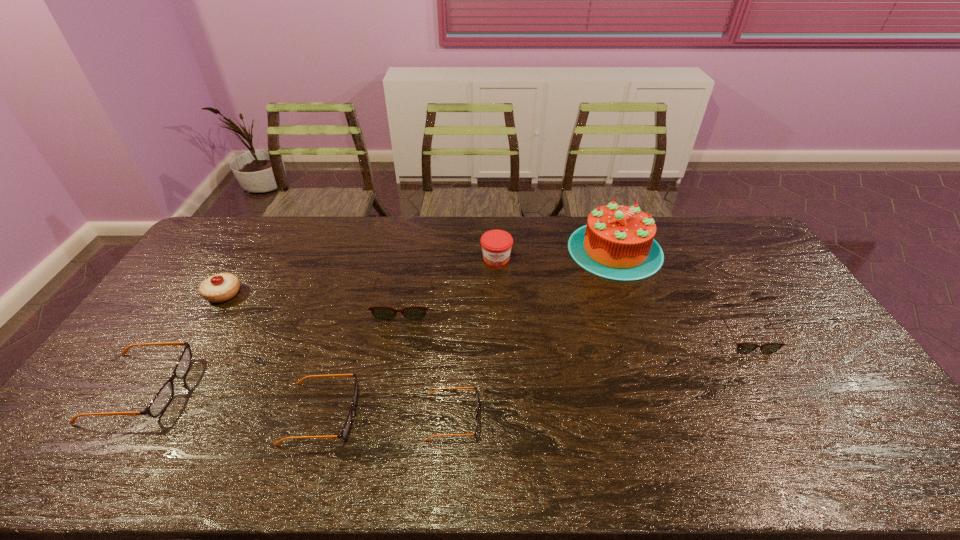
Locate an element on the screen. cake is located at coordinates (617, 243).

The width and height of the screenshot is (960, 540). What are the coordinates of `the tallest object` in the screenshot? It's located at (617, 243).

The image size is (960, 540). In order to click on the third object from right to left in this screenshot , I will do `click(496, 244)`.

This screenshot has width=960, height=540. Find the location of `red jam`. red jam is located at coordinates (496, 244).

This screenshot has width=960, height=540. What are the coordinates of `beige pastry` in the screenshot? It's located at (221, 287).

Identify the location of the bigger brown spectacles. The width and height of the screenshot is (960, 540). (381, 313).

Identify the location of the farther brown spectacles. (x=381, y=313).

You are a GUI agent. You are given a task and a screenshot of the screen. Output one action in this format:
    pyautogui.click(x=<x>, y=<y>)
    Task: Click on the biggest black spectacles
    The image size is (960, 540).
    Given the screenshot: What is the action you would take?
    pyautogui.click(x=161, y=400)

Locate an element on the screen. This screenshot has width=960, height=540. the leftmost black spectacles is located at coordinates (161, 400).

You are a GUI agent. You are given a task and a screenshot of the screen. Output one action in this format:
    pyautogui.click(x=<x>, y=<y>)
    Task: Click on the second biggest black spectacles
    
    Given the screenshot: What is the action you would take?
    [346, 428]